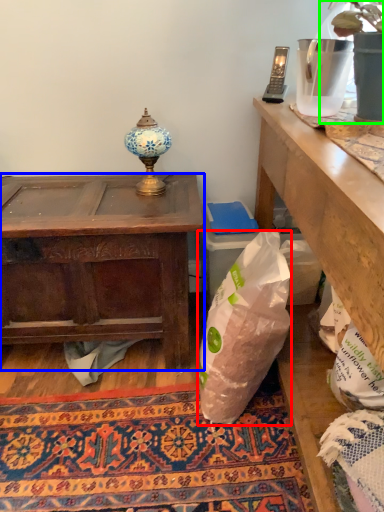
Question: Which object is the farthest from plastic bag (highlighted by a red box)? Choose among these: desk (highlighted by a blue box) or houseplant (highlighted by a green box).

Choices:
 (A) desk
 (B) houseplant

Answer: (B)